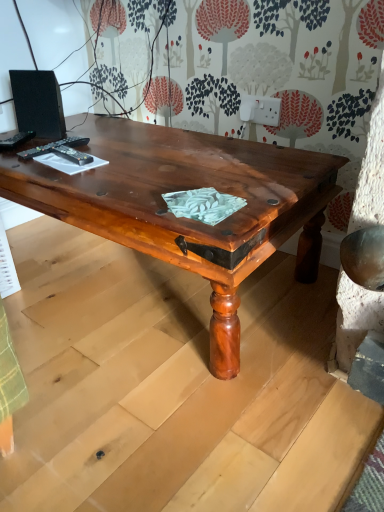
Question: From their relative heights in the image, would you say black plastic remote control at upper left, positioned as the 1th remote control in right-to-left order, is taller or shorter than black plastic remote control at upper left, acting as the third remote control starting from the right?

Choices:
 (A) tall
 (B) short

Answer: (A)

Question: Is black plastic remote control at upper left, the 3th remote control viewed from the left, to the left or to the right of black plastic remote control at upper left, the first remote control in the left-to-right sequence, in the image?

Choices:
 (A) left
 (B) right

Answer: (B)

Question: Considering the real-world distances, which object is closest to the black plastic remote control at upper left, the 3th remote control viewed from the left?

Choices:
 (A) shiny brown wood coffee table at center
 (B) black plastic remote control at upper left, acting as the third remote control starting from the right
 (C) black matte speaker at upper left
 (D) black plastic remote control at upper left, the second remote control in the right-to-left sequence

Answer: (D)

Question: Which is nearer to the black plastic remote control at upper left, the second remote control in the right-to-left sequence?

Choices:
 (A) black matte speaker at upper left
 (B) black plastic remote control at upper left, the 3th remote control viewed from the left
 (C) shiny brown wood coffee table at center
 (D) black plastic remote control at upper left, acting as the third remote control starting from the right

Answer: (B)